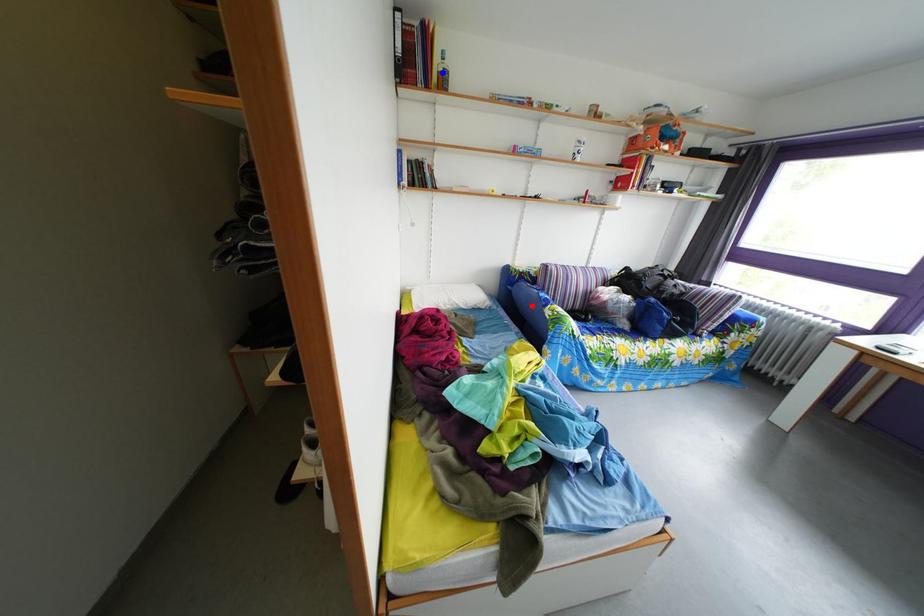
Question: Which of the two points in the image is closer to the camera?

Choices:
 (A) Blue point is closer.
 (B) Red point is closer.

Answer: (A)